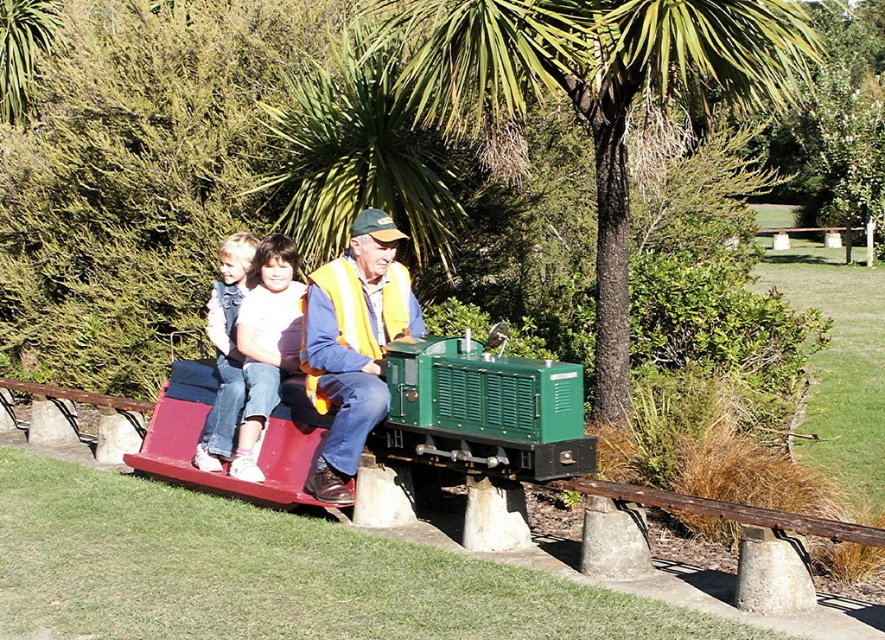
You are a passenger on the green matte train at center and you notice a white cotton shirt at center. Is the train located above or below the shirt?

The green matte train at center is positioned under the white cotton shirt at center, so the train is located below the shirt.

You are a park visitor who wants to take a photo of the green matte train at center and the yellow reflective vest at center from a distance. Which object will appear wider in your photo?

The green matte train at center will appear wider in the photo because its width surpasses that of the yellow reflective vest at center.

Consider the image. You are a passenger on the green matte train at center and want to see the green leafy palm tree at center. Which direction should you look to see it?

The green leafy palm tree at center is to the right of the green matte train at center, so you should look to your right to see it.